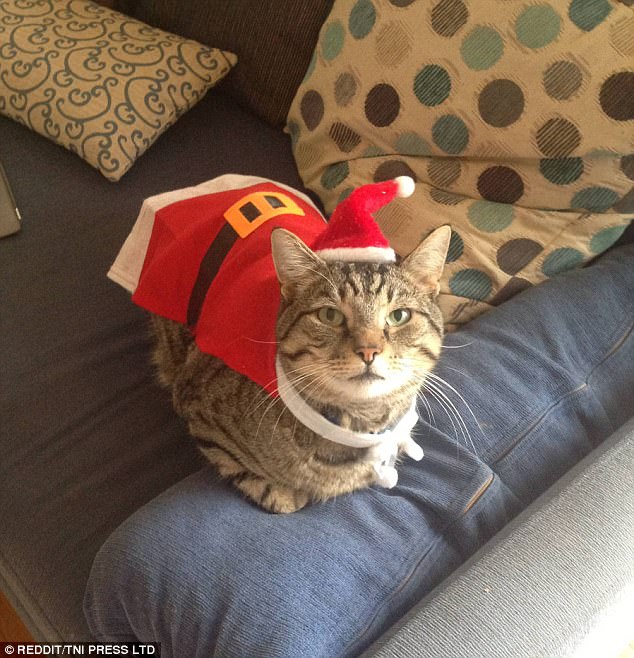
At what (x,y) coordinates should I click in order to perform the action: click on couch. Please return your answer as a coordinate pair (x, y). Image resolution: width=634 pixels, height=658 pixels. Looking at the image, I should click on (115, 383).